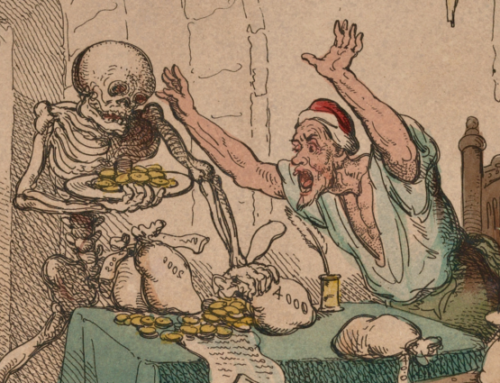
Find the location of a particular element. The height and width of the screenshot is (383, 500). wall is located at coordinates (426, 73).